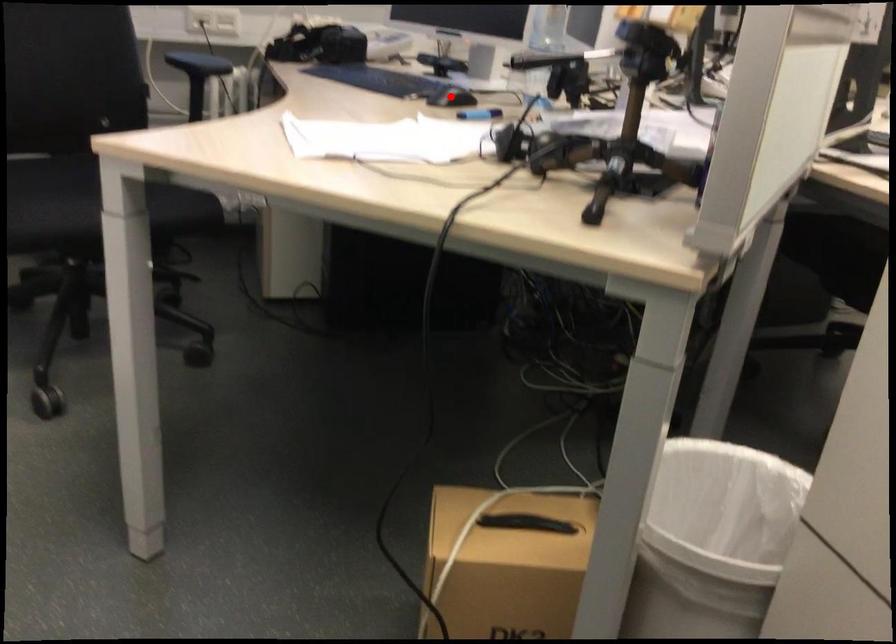
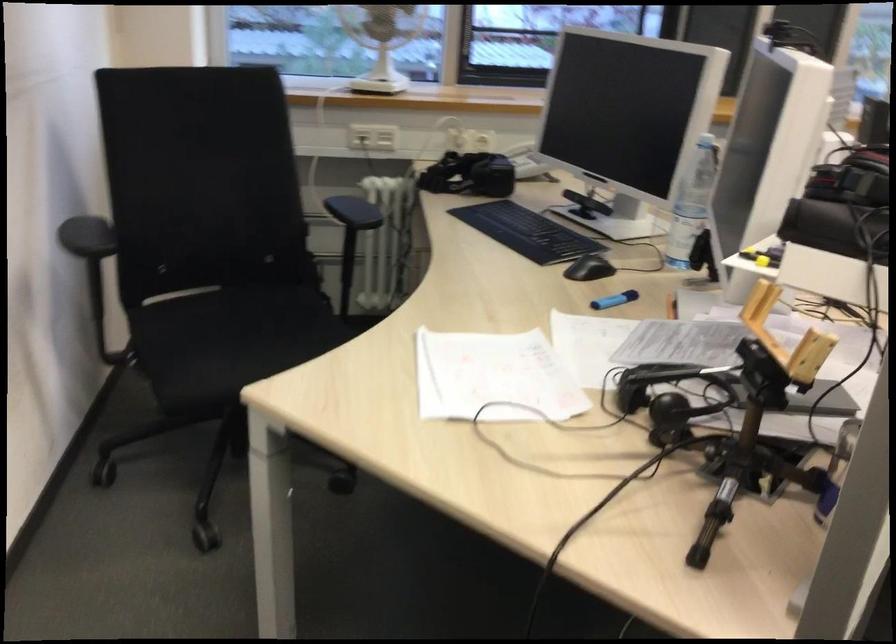
The point at the highlighted location is marked in the first image. Where is the corresponding point in the second image?

(589, 268)